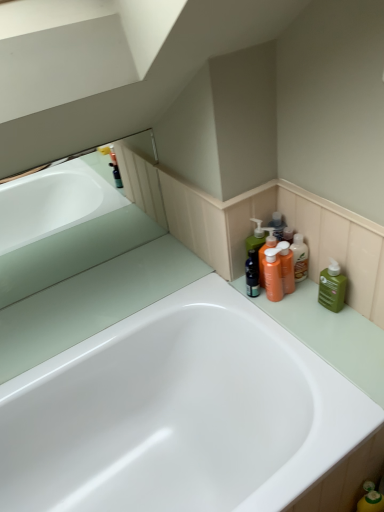
You are a GUI agent. You are given a task and a screenshot of the screen. Output one action in this format:
    pyautogui.click(x=<x>, y=<y>)
    Task: Click on the vacant space that is to the left of orange matte pump bottle at upper right, which is counted as the 1th cleaning product, starting from the left
    This screenshot has height=512, width=384.
    Given the screenshot: What is the action you would take?
    pyautogui.click(x=236, y=298)